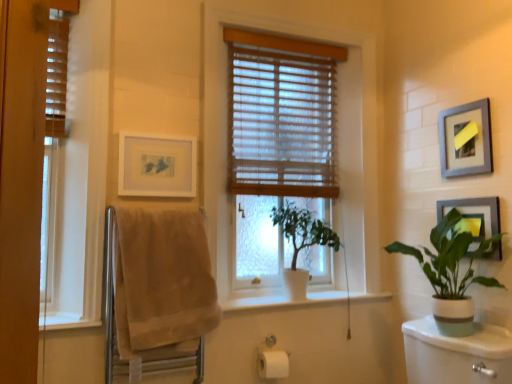
Question: Is wooden blinds at left, placed as the 2th window when sorted from right to left, completely or partially outside of beige cotton towel at left?

Choices:
 (A) yes
 (B) no

Answer: (A)

Question: Considering the relative positions of wooden blinds at left, acting as the 1th window starting from the left, and beige cotton towel at left in the image provided, is wooden blinds at left, acting as the 1th window starting from the left, to the left of beige cotton towel at left from the viewer's perspective?

Choices:
 (A) yes
 (B) no

Answer: (A)

Question: Is wooden blinds at left, placed as the 2th window when sorted from right to left, positioned behind beige cotton towel at left?

Choices:
 (A) no
 (B) yes

Answer: (B)

Question: Does wooden blinds at left, acting as the 2th window starting from the back, come in front of beige cotton towel at left?

Choices:
 (A) yes
 (B) no

Answer: (B)

Question: Can you confirm if wooden blinds at left, acting as the 2th window starting from the back, is smaller than beige cotton towel at left?

Choices:
 (A) yes
 (B) no

Answer: (B)

Question: Is wooden blinds at left, acting as the 2th window starting from the back, far away from beige cotton towel at left?

Choices:
 (A) yes
 (B) no

Answer: (B)

Question: Would you say white ceramic plant at right, the first houseplant viewed from the right, is outside beige cotton towel at left?

Choices:
 (A) yes
 (B) no

Answer: (A)

Question: Is white ceramic plant at right, the first houseplant viewed from the right, positioned in front of beige cotton towel at left?

Choices:
 (A) no
 (B) yes

Answer: (B)

Question: Can you see white ceramic plant at right, which is the 2th houseplant in left-to-right order, touching beige cotton towel at left?

Choices:
 (A) yes
 (B) no

Answer: (B)

Question: Considering the relative positions of white ceramic plant at right, which is the 2th houseplant in left-to-right order, and beige cotton towel at left in the image provided, is white ceramic plant at right, which is the 2th houseplant in left-to-right order, to the right of beige cotton towel at left from the viewer's perspective?

Choices:
 (A) no
 (B) yes

Answer: (B)

Question: Is white ceramic plant at right, the first houseplant viewed from the right, facing towards beige cotton towel at left?

Choices:
 (A) no
 (B) yes

Answer: (B)

Question: Is white ceramic plant at right, which is the 2th houseplant in left-to-right order, to the left of beige cotton towel at left from the viewer's perspective?

Choices:
 (A) no
 (B) yes

Answer: (A)

Question: Is white matte picture frame at upper left, acting as the first picture frame starting from the left, not inside metallic silver picture frame at upper right, the 2th picture frame from the right?

Choices:
 (A) no
 (B) yes

Answer: (B)